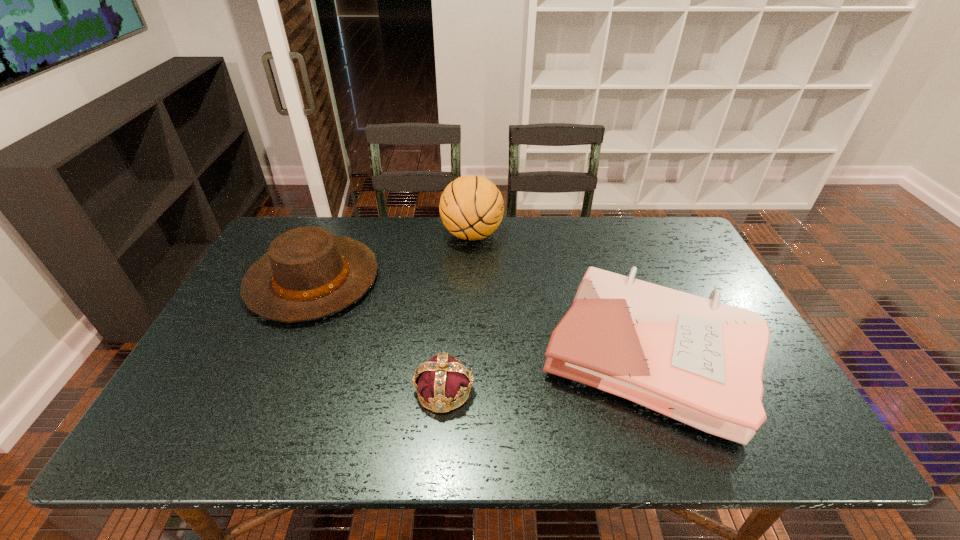
At what (x,y) coordinates should I click in order to perform the action: click on the tallest object. Please return your answer as a coordinate pair (x, y). Looking at the image, I should click on (471, 207).

Locate an element on the screen. the second tallest object is located at coordinates (308, 273).

This screenshot has width=960, height=540. I want to click on cowboy hat, so click(308, 273).

Identify the location of phonebook. (699, 361).

This screenshot has height=540, width=960. What are the coordinates of `crown` in the screenshot? It's located at (441, 380).

Where is `vacant space located on the surface of the tallest object near the brand logo`? The image size is (960, 540). vacant space located on the surface of the tallest object near the brand logo is located at coordinates (536, 234).

This screenshot has height=540, width=960. I want to click on free space located 0.230m on the front of the leftmost object, so click(259, 403).

Locate an element on the screen. The height and width of the screenshot is (540, 960). vacant space located on the back of the phonebook is located at coordinates (613, 259).

This screenshot has height=540, width=960. I want to click on free point located 0.340m on the right of the crown, so click(621, 390).

Find the location of `basketball that is at the far edge`. basketball that is at the far edge is located at coordinates (471, 207).